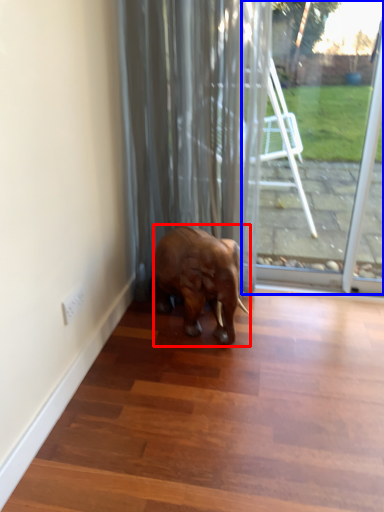
Question: Which point is further to the camera, elephant (highlighted by a red box) or glass door (highlighted by a blue box)?

Choices:
 (A) elephant
 (B) glass door

Answer: (B)